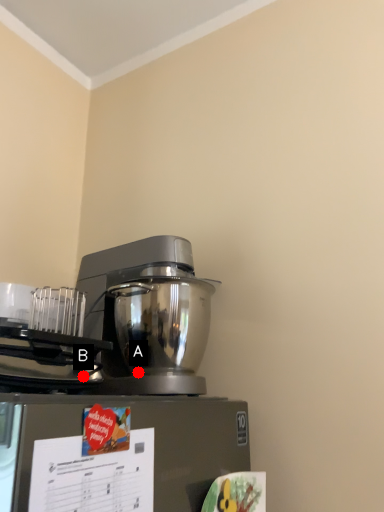
Question: Two points are circled on the image, labeled by A and B beside each circle. Which of the following is the farthest from the observer?

Choices:
 (A) A is further
 (B) B is further

Answer: (A)